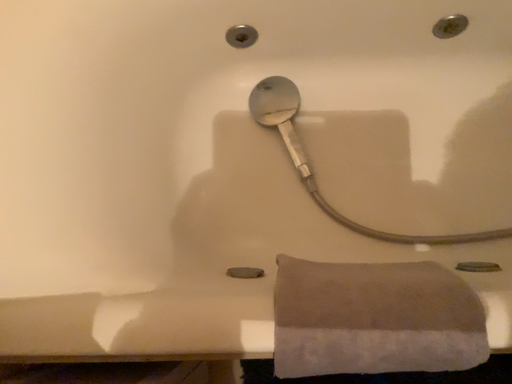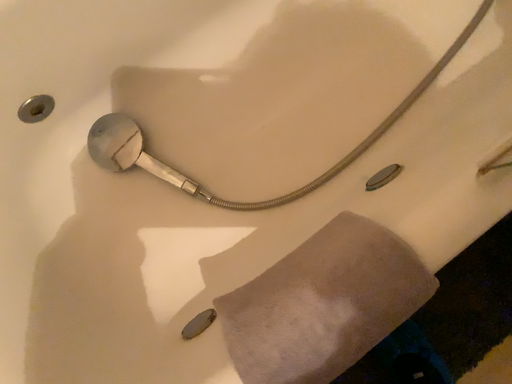
Question: Which way did the camera rotate in the video?

Choices:
 (A) rotated left
 (B) rotated right

Answer: (B)